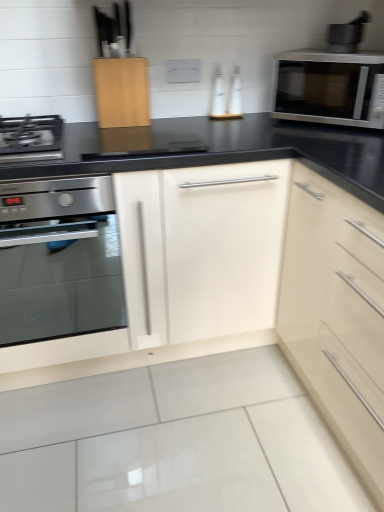
Locate an element on the screen. This screenshot has height=512, width=384. vacant region in front of metallic gray mortar and pestle at upper right is located at coordinates (357, 52).